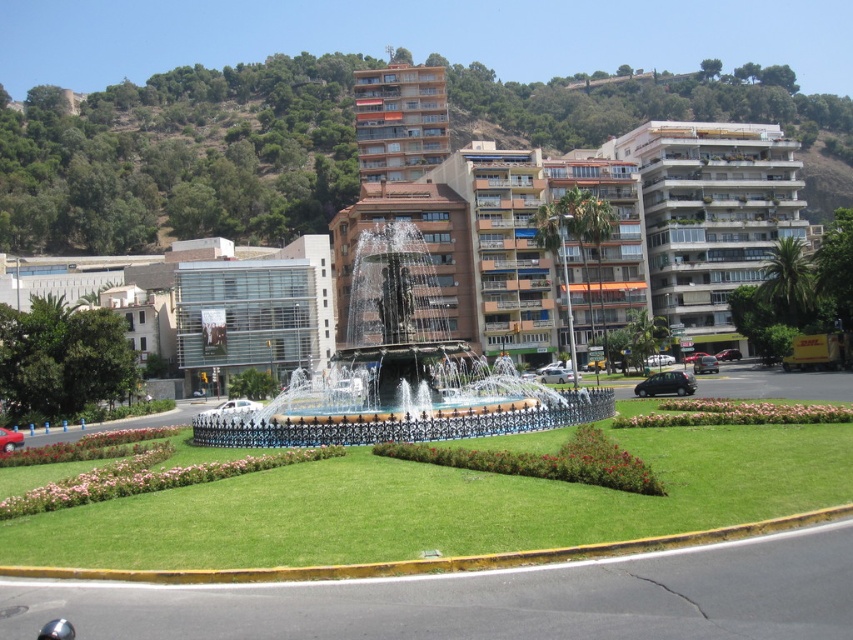
Can you confirm if white glossy building at upper right is wider than orange glass windows at center?

Indeed, white glossy building at upper right has a greater width compared to orange glass windows at center.

Between point (715, 252) and point (404, 176), which one is positioned in front?

Point (715, 252)

Does point (674, 170) come in front of point (355, 131)?

That is True.

Where is `white glossy building at upper right`? white glossy building at upper right is located at coordinates (711, 216).

Who is shorter, black stone fountain at center or orange glass windows at center?

black stone fountain at center

Does point (251, 424) come farther from viewer compared to point (389, 74)?

No, (251, 424) is closer to viewer.

Find the location of a particular element. The width and height of the screenshot is (853, 640). black stone fountain at center is located at coordinates (399, 372).

Can you confirm if black stone fountain at center is taller than white glossy building at upper right?

Incorrect, black stone fountain at center's height is not larger of white glossy building at upper right's.

Can you confirm if black stone fountain at center is shorter than white glossy building at upper right?

Yes.

Find the location of a particular element. The image size is (853, 640). black stone fountain at center is located at coordinates (399, 372).